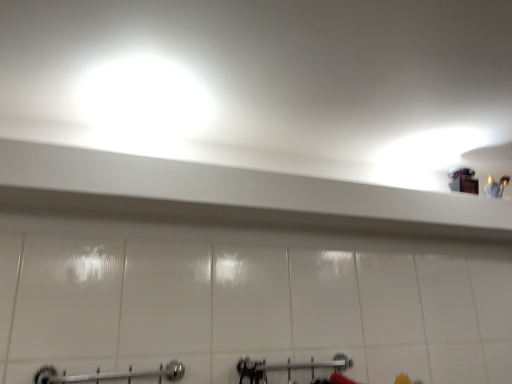
What do you see at coordinates (110, 374) in the screenshot? This screenshot has height=384, width=512. I see `chrome metallic towel rack at lower center` at bounding box center [110, 374].

Locate an element on the screen. chrome metallic towel rack at lower center is located at coordinates (110, 374).

Describe the element at coordinates (287, 368) in the screenshot. I see `brushed metal shower at lower center` at that location.

You are a GUI agent. You are given a task and a screenshot of the screen. Output one action in this format:
    pyautogui.click(x=<x>, y=<y>)
    Task: Click on the brushed metal shower at lower center
    
    Given the screenshot: What is the action you would take?
    pyautogui.click(x=287, y=368)

I want to click on chrome metallic towel rack at lower center, so click(x=110, y=374).

Which object is positioned more to the right, brushed metal shower at lower center or chrome metallic towel rack at lower center?

brushed metal shower at lower center is more to the right.

Does brushed metal shower at lower center come behind chrome metallic towel rack at lower center?

Yes.

Does point (259, 369) come behind point (177, 377)?

Yes, it is.

From the image's perspective, between brushed metal shower at lower center and chrome metallic towel rack at lower center, who is located below?

brushed metal shower at lower center is shown below in the image.

From a real-world perspective, between brushed metal shower at lower center and chrome metallic towel rack at lower center, who is vertically higher?

chrome metallic towel rack at lower center.

Between brushed metal shower at lower center and chrome metallic towel rack at lower center, which one has larger width?

With larger width is brushed metal shower at lower center.

From the picture: Which of these two, brushed metal shower at lower center or chrome metallic towel rack at lower center, stands shorter?

Standing shorter between the two is chrome metallic towel rack at lower center.

Looking at the image, does brushed metal shower at lower center seem bigger or smaller compared to chrome metallic towel rack at lower center?

brushed metal shower at lower center is bigger than chrome metallic towel rack at lower center.

Is brushed metal shower at lower center not inside chrome metallic towel rack at lower center?

That's correct, brushed metal shower at lower center is outside of chrome metallic towel rack at lower center.

Are brushed metal shower at lower center and chrome metallic towel rack at lower center beside each other?

There is a gap between brushed metal shower at lower center and chrome metallic towel rack at lower center.

Is brushed metal shower at lower center facing towards chrome metallic towel rack at lower center?

No, brushed metal shower at lower center is not aimed at chrome metallic towel rack at lower center.

What's the angular difference between brushed metal shower at lower center and chrome metallic towel rack at lower center's facing directions?

The angle between the facing direction of brushed metal shower at lower center and the facing direction of chrome metallic towel rack at lower center is 0.000338 degrees.

The width and height of the screenshot is (512, 384). I want to click on towel rack above the brushed metal shower at lower center (from a real-world perspective), so click(110, 374).

Can you confirm if chrome metallic towel rack at lower center is positioned to the left of brushed metal shower at lower center?

Indeed, chrome metallic towel rack at lower center is positioned on the left side of brushed metal shower at lower center.

In the scene shown: Is chrome metallic towel rack at lower center behind brushed metal shower at lower center?

No, chrome metallic towel rack at lower center is closer to the camera.

Which is behind, point (169, 372) or point (333, 358)?

The point (333, 358) is farther.

From the image's perspective, between chrome metallic towel rack at lower center and brushed metal shower at lower center, who is located below?

From the image's view, brushed metal shower at lower center is below.

From a real-world perspective, is chrome metallic towel rack at lower center located beneath brushed metal shower at lower center?

No, from a real-world perspective, chrome metallic towel rack at lower center is not below brushed metal shower at lower center.

Does chrome metallic towel rack at lower center have a lesser width compared to brushed metal shower at lower center?

Indeed, chrome metallic towel rack at lower center has a lesser width compared to brushed metal shower at lower center.

Considering the relative sizes of chrome metallic towel rack at lower center and brushed metal shower at lower center in the image provided, is chrome metallic towel rack at lower center shorter than brushed metal shower at lower center?

Correct, chrome metallic towel rack at lower center is not as tall as brushed metal shower at lower center.

Is chrome metallic towel rack at lower center smaller than brushed metal shower at lower center?

Correct, chrome metallic towel rack at lower center occupies less space than brushed metal shower at lower center.

Choose the correct answer: Is chrome metallic towel rack at lower center inside brushed metal shower at lower center or outside it?

chrome metallic towel rack at lower center lies outside brushed metal shower at lower center.

Is chrome metallic towel rack at lower center not close to brushed metal shower at lower center?

chrome metallic towel rack at lower center is actually quite close to brushed metal shower at lower center.

Is chrome metallic towel rack at lower center oriented away from brushed metal shower at lower center?

No, chrome metallic towel rack at lower center is not facing away from brushed metal shower at lower center.

Find the location of a particular element. The width and height of the screenshot is (512, 384). shower that appears on the right of chrome metallic towel rack at lower center is located at coordinates (287, 368).

Locate an element on the screen. towel rack above the brushed metal shower at lower center (from a real-world perspective) is located at coordinates (110, 374).

The height and width of the screenshot is (384, 512). Find the location of `towel rack lying in front of the brushed metal shower at lower center`. towel rack lying in front of the brushed metal shower at lower center is located at coordinates (110, 374).